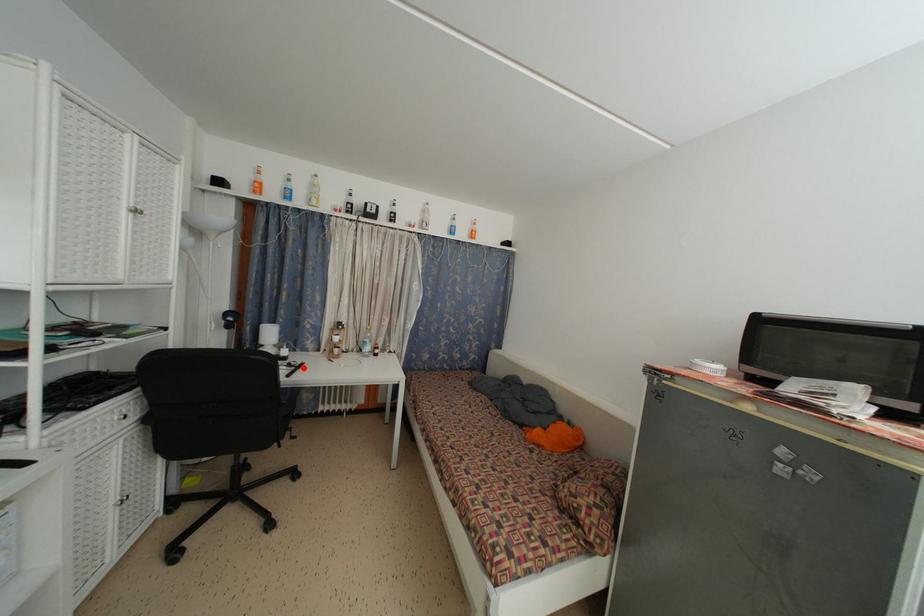
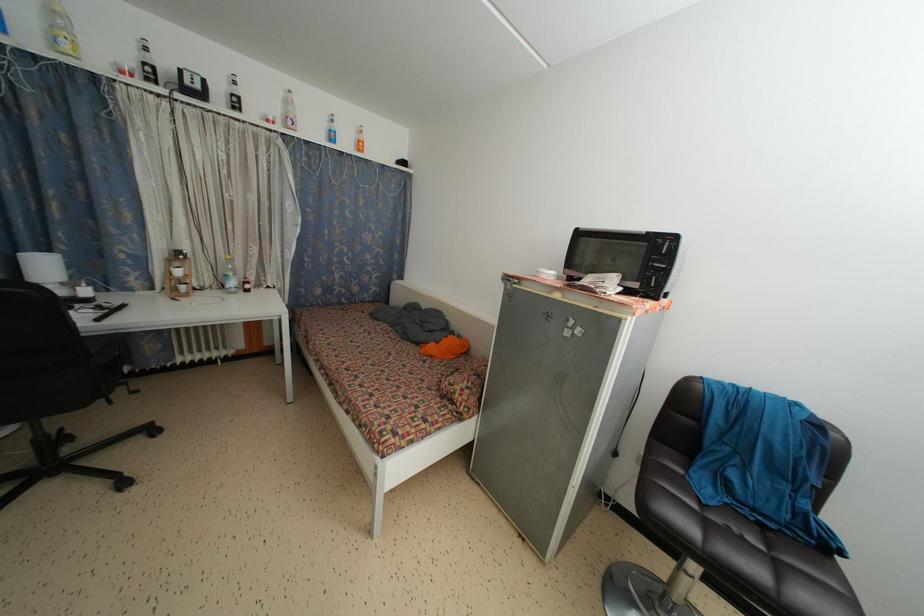
Find the pixel in the second image that matches the highlighted location in the first image.

(122, 310)